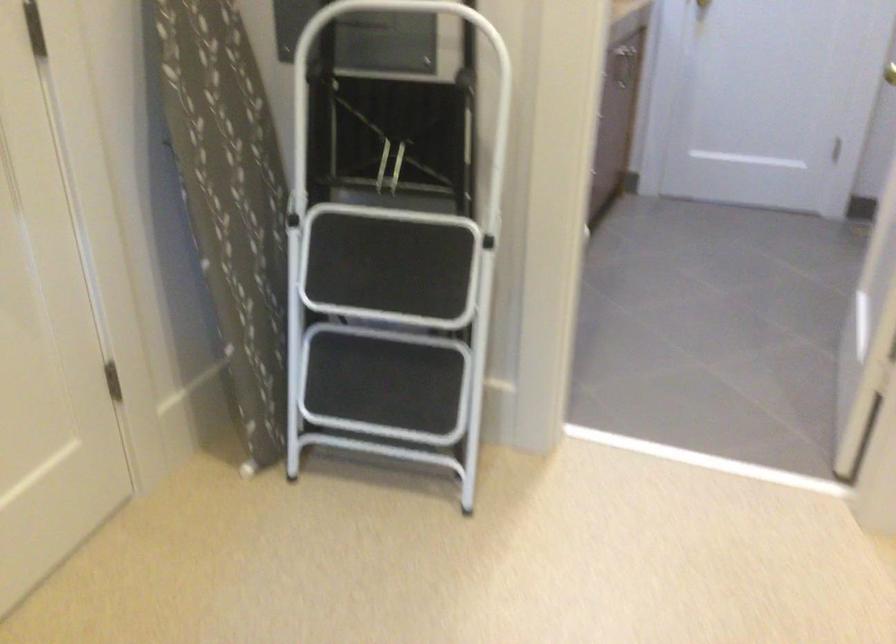
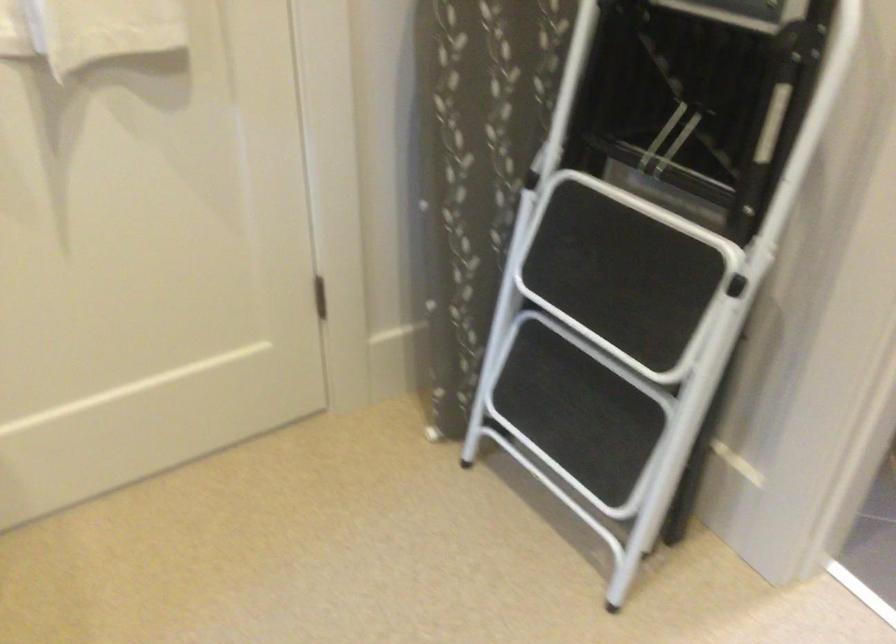
Locate, in the second image, the point that corresponds to point (406, 216) in the first image.

(658, 216)